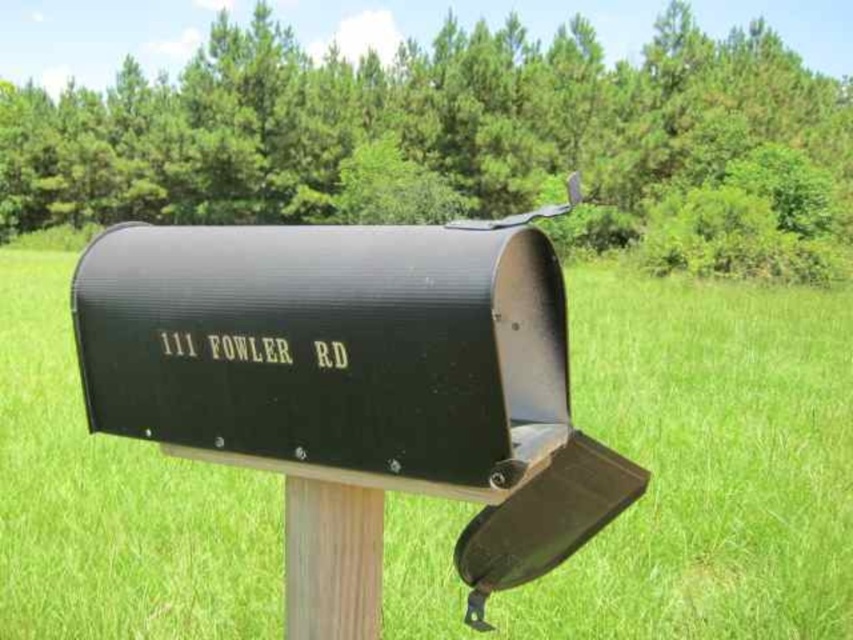
You are a postal worker delivering mail to the address on the black matte mailbox at center. You need to place a large package inside it. Considering the size of the wooden post at center, will the mailbox have enough space to accommodate the package?

The black matte mailbox at center has a larger size compared to wooden post at center, so it should have sufficient space to accommodate the large package.

You are standing at the origin point of a coordinate system where the image is displayed. You want to locate the black matte mailbox at center. What are its coordinates?

The black matte mailbox at center is located at coordinates point (679, 474).